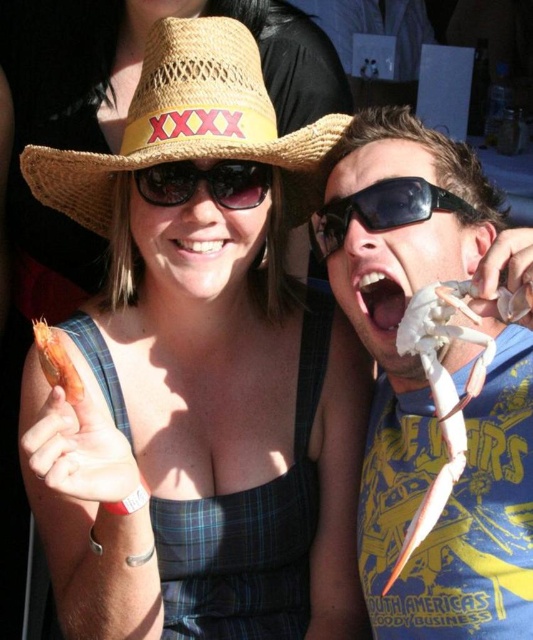
You are standing in front of the image and want to locate the straw hat at upper left. What are its coordinates?

The 2D location of the straw hat at upper left is at point (x=172, y=337).

You are a photographer at the event and need to capture a closeup shot of the white matte crab claw at right and the black reflective sunglasses at upper center. Which object should you zoom in on to ensure it fills the frame more without moving the camera?

The white matte crab claw at right is larger in size compared to the black reflective sunglasses at upper center, so you should zoom in on the white matte crab claw at right to fill the frame more without moving the camera.

You are a photographer at the event and want to capture both the white matte crab claw at right and the black reflective sunglasses at upper center in the same frame. Since you want to emphasize the crab claw, which object should you position closer to the camera?

To emphasize the white matte crab claw at right, position it closer to the camera since it has a lesser width compared to the black reflective sunglasses at upper center, making it appear larger in the photo.